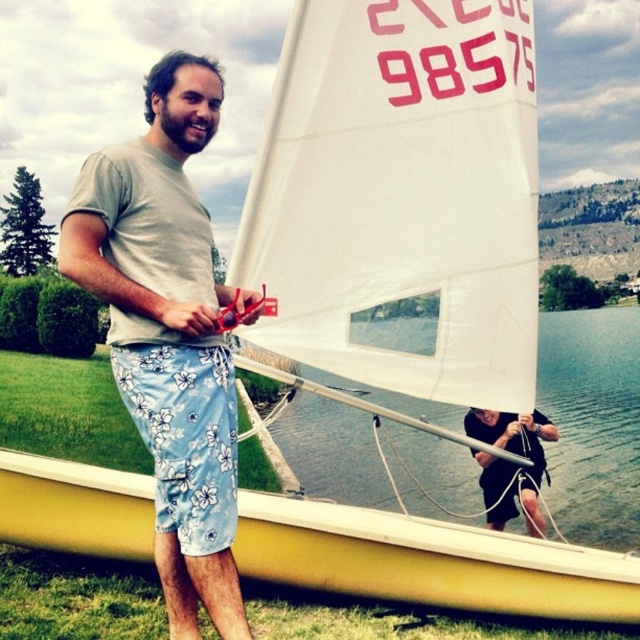
Question: Is yellow plastic canoe at lower left further to the viewer compared to transparent water at sailboat center?

Choices:
 (A) no
 (B) yes

Answer: (B)

Question: Can you confirm if gray cotton t-shirt at center is positioned below matte black shorts at center?

Choices:
 (A) no
 (B) yes

Answer: (A)

Question: Which of the following is the closest to the observer?

Choices:
 (A) yellow plastic canoe at lower left
 (B) matte black shorts at center

Answer: (A)

Question: Is yellow plastic canoe at lower left below matte black shorts at center?

Choices:
 (A) yes
 (B) no

Answer: (A)

Question: Which point is closer to the camera?

Choices:
 (A) (282, 554)
 (B) (211, 342)

Answer: (B)

Question: Considering the real-world distances, which object is farthest from the matte black shorts at center?

Choices:
 (A) blue floral shorts at center
 (B) gray cotton t-shirt at center

Answer: (B)